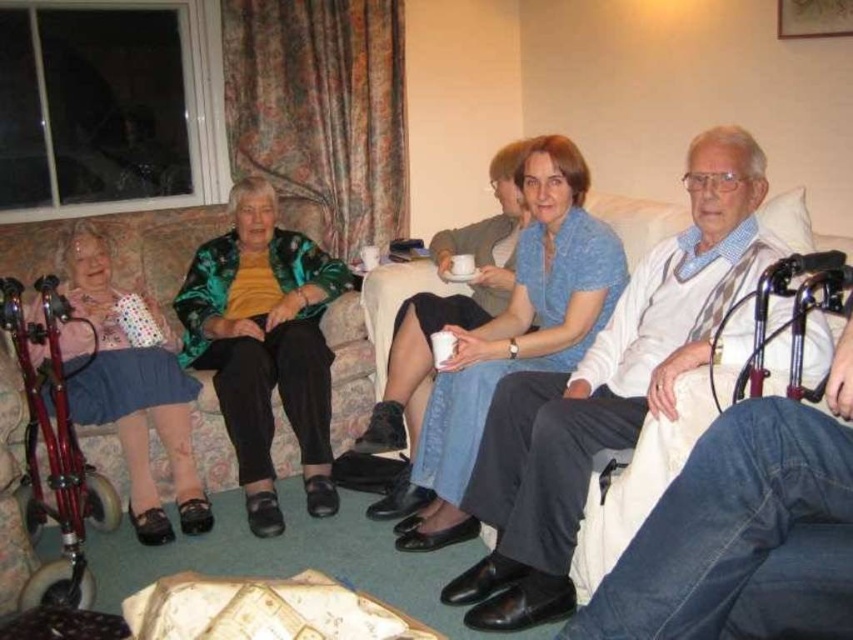
Does velvet fabric couch at left have a larger size compared to polka dot fabric dress at left?

Yes, velvet fabric couch at left is bigger than polka dot fabric dress at left.

Does velvet fabric couch at left have a smaller size compared to polka dot fabric dress at left?

Incorrect, velvet fabric couch at left is not smaller in size than polka dot fabric dress at left.

Is point (44, 243) behind point (195, 531)?

Yes, it is behind point (195, 531).

This screenshot has height=640, width=853. I want to click on velvet fabric couch at left, so click(119, 250).

Locate an element on the screen. green metallic jacket at center is located at coordinates (265, 346).

Who is more forward, (x=254, y=214) or (x=50, y=262)?

Point (x=50, y=262) is more forward.

Is point (268, 348) in front of point (370, 356)?

Yes.

Find the location of a particular element. The width and height of the screenshot is (853, 640). green metallic jacket at center is located at coordinates (265, 346).

Is green metallic jacket at center positioned behind polka dot fabric dress at left?

Yes, it is.

Is point (329, 272) less distant than point (178, 493)?

No, it is not.

The width and height of the screenshot is (853, 640). I want to click on green metallic jacket at center, so point(265,346).